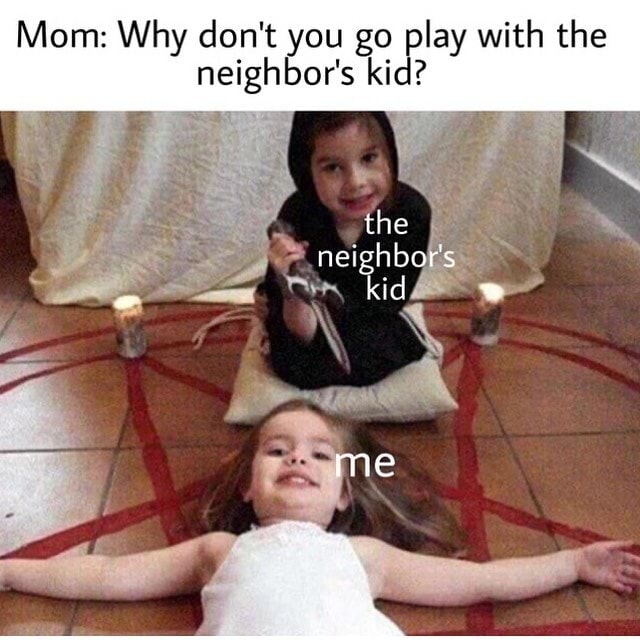
The image size is (640, 640). I want to click on sheet, so click(157, 193).